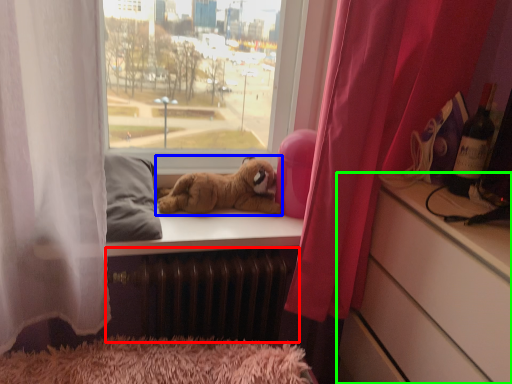
Question: Which object is the farthest from radiator (highlighted by a red box)? Choose among these: dog (highlighted by a blue box) or cabinetry (highlighted by a green box).

Choices:
 (A) dog
 (B) cabinetry

Answer: (B)